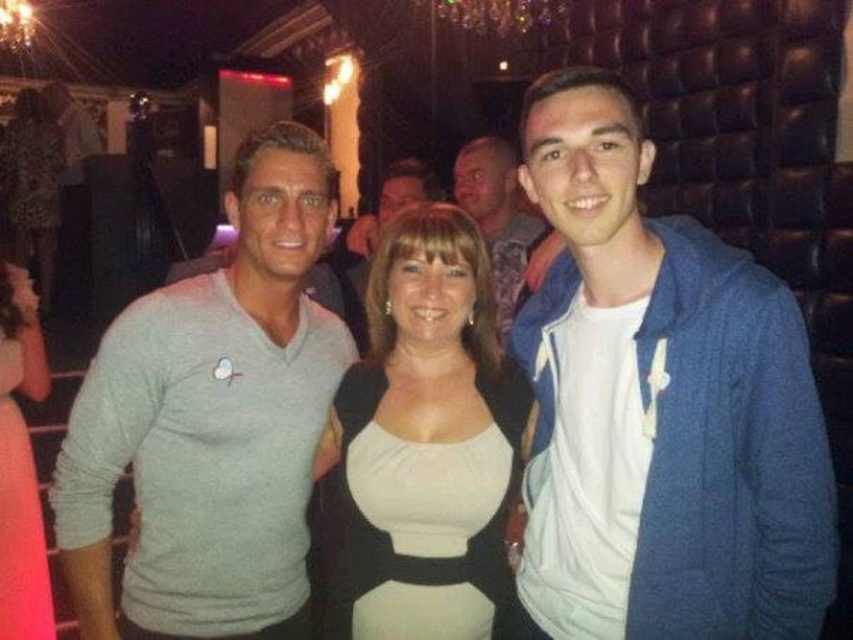
Question: Which object is closer to the camera taking this photo?

Choices:
 (A) blue corduroy jacket at center
 (B) blue cotton hoodie at center
 (C) white matte dress at center
 (D) matte black dress at center

Answer: (A)

Question: Where is white matte dress at center located in relation to blue cotton hoodie at center in the image?

Choices:
 (A) right
 (B) left

Answer: (B)

Question: Which point is farther from the camera taking this photo?

Choices:
 (A) (476, 189)
 (B) (19, 192)

Answer: (B)

Question: Can you confirm if gray matte sweater at left is bigger than matte black dress at center?

Choices:
 (A) yes
 (B) no

Answer: (B)

Question: Can you confirm if gray matte sweater at left is bigger than blue cotton hoodie at center?

Choices:
 (A) yes
 (B) no

Answer: (A)

Question: Which of the following is the farthest from the observer?

Choices:
 (A) blue corduroy jacket at center
 (B) matte black dress at center

Answer: (B)